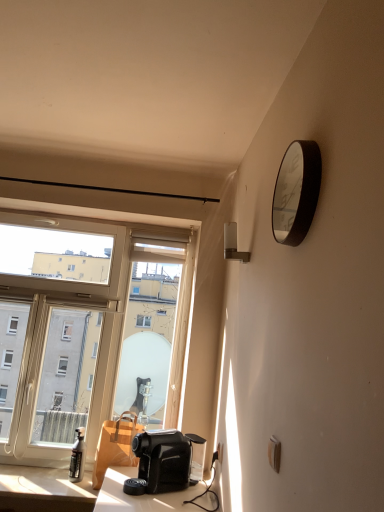
Question: Is transparent glass window at left to the left or to the right of matte black spray bottle at lower left in the image?

Choices:
 (A) left
 (B) right

Answer: (A)

Question: Is transparent glass window at left in front of or behind matte black spray bottle at lower left in the image?

Choices:
 (A) behind
 (B) front

Answer: (A)

Question: Estimate the real-world distances between objects in this image. Which object is farther from the metallic silver clock at upper right?

Choices:
 (A) matte black spray bottle at lower left
 (B) white plastic electric outlet at lower right
 (C) white plastic lamp at upper right
 (D) matte black table at lower left
 (E) transparent glass window at left

Answer: (A)

Question: Which object is positioned closest to the white plastic lamp at upper right?

Choices:
 (A) white plastic electric outlet at lower right
 (B) matte black table at lower left
 (C) matte black spray bottle at lower left
 (D) metallic silver clock at upper right
 (E) transparent glass window at left

Answer: (D)